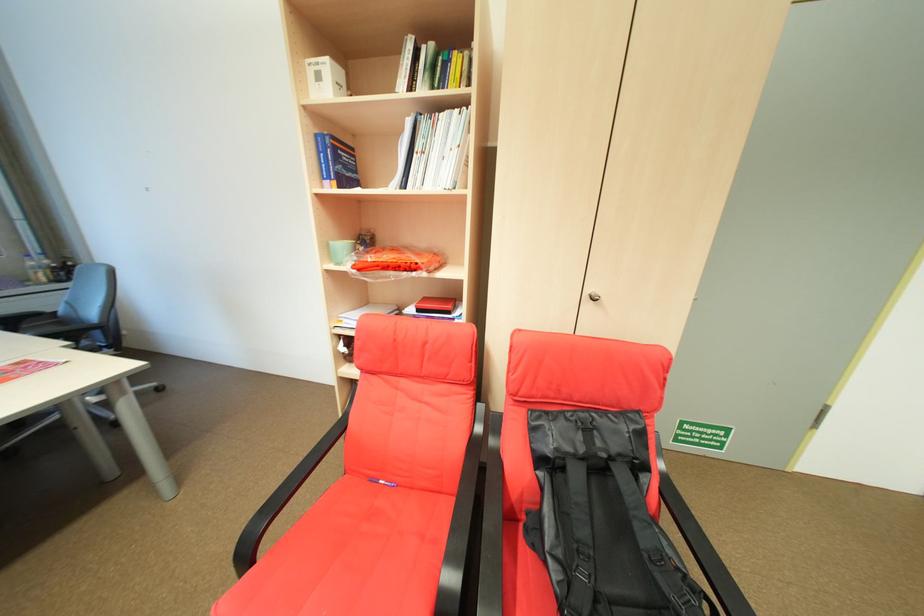
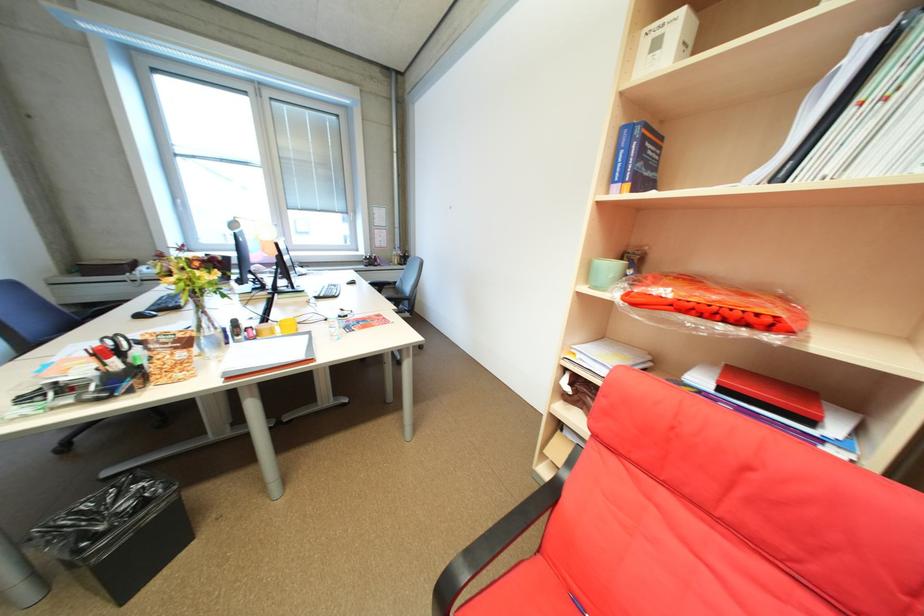
Question: The camera is either moving clockwise (left) or counter-clockwise (right) around the object. The first image is from the beginning of the video and the second image is from the end. Is the camera moving left or right when shooting the video?

Choices:
 (A) Left
 (B) Right

Answer: (B)